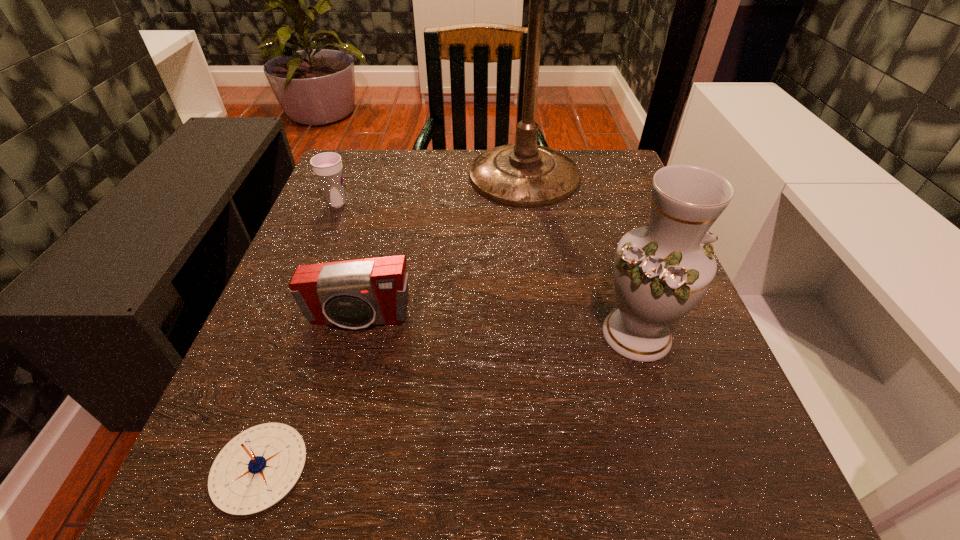
The height and width of the screenshot is (540, 960). Identify the location of vacant space located on the right of the compass. (562, 467).

You are a GUI agent. You are given a task and a screenshot of the screen. Output one action in this format:
    pyautogui.click(x=<x>, y=<y>)
    Task: Click on the table lamp that is at the far edge
    
    Given the screenshot: What is the action you would take?
    pyautogui.click(x=524, y=175)

This screenshot has width=960, height=540. I want to click on cup that is at the far edge, so click(327, 166).

The width and height of the screenshot is (960, 540). I want to click on object that is at the near edge, so click(x=256, y=469).

Find the location of `camera at the left edge`. camera at the left edge is located at coordinates (354, 294).

The image size is (960, 540). Identify the location of cup positioned at the left edge. (327, 166).

The image size is (960, 540). Find the location of `compass at the left edge`. compass at the left edge is located at coordinates (256, 469).

Find the location of a particular element. table lamp that is at the right edge is located at coordinates (524, 175).

The height and width of the screenshot is (540, 960). Identify the location of vase situated at the right edge. (661, 271).

You are a GUI agent. You are given a task and a screenshot of the screen. Output one action in this format:
    pyautogui.click(x=<x>, y=<y>)
    Task: Click on the object positioned at the far left corner
    The image size is (960, 540).
    Given the screenshot: What is the action you would take?
    pyautogui.click(x=327, y=166)